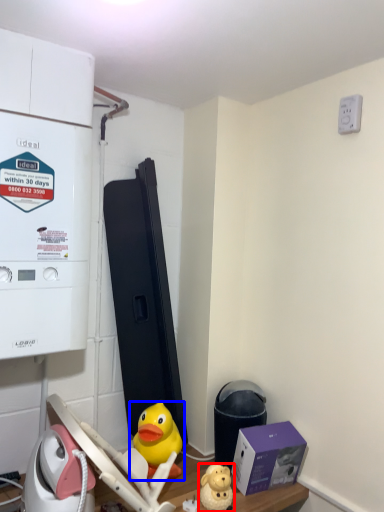
Question: Which point is further to the camera, toy (highlighted by a red box) or toy (highlighted by a blue box)?

Choices:
 (A) toy
 (B) toy

Answer: (B)